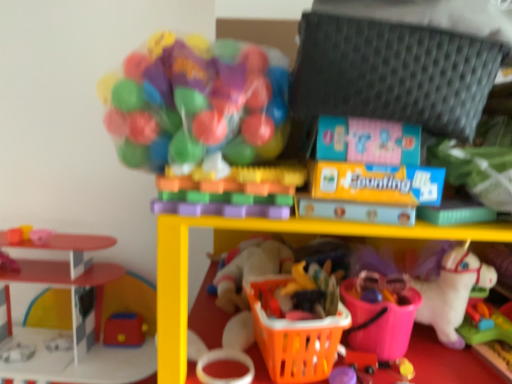
Question: From a real-world perspective, is rubber yellow ball at lower center, arranged as the 2th toy when viewed from the right, below pink rubber ball at left, the second toy in the left-to-right sequence?

Choices:
 (A) no
 (B) yes

Answer: (B)

Question: Is rubber yellow ball at lower center, which ranks as the seventh toy in left-to-right order, oriented away from pink rubber ball at left, the second toy in the left-to-right sequence?

Choices:
 (A) yes
 (B) no

Answer: (B)

Question: From the image's perspective, is rubber yellow ball at lower center, which ranks as the seventh toy in left-to-right order, above pink rubber ball at left, the second toy in the left-to-right sequence?

Choices:
 (A) no
 (B) yes

Answer: (A)

Question: Can you see rubber yellow ball at lower center, arranged as the 2th toy when viewed from the right, touching pink rubber ball at left, the 7th toy from the right?

Choices:
 (A) yes
 (B) no

Answer: (B)

Question: Is rubber yellow ball at lower center, arranged as the 2th toy when viewed from the right, bigger than pink rubber ball at left, the 7th toy from the right?

Choices:
 (A) no
 (B) yes

Answer: (A)

Question: Can you confirm if rubber yellow ball at lower center, which ranks as the seventh toy in left-to-right order, is thinner than pink rubber ball at left, the second toy in the left-to-right sequence?

Choices:
 (A) no
 (B) yes

Answer: (B)

Question: Is the depth of rubberized red toy at lower left, acting as the 5th toy starting from the right, less than that of rubber yellow ball at lower center, arranged as the 2th toy when viewed from the right?

Choices:
 (A) no
 (B) yes

Answer: (A)

Question: Is rubberized red toy at lower left, acting as the 5th toy starting from the right, aimed at rubber yellow ball at lower center, which ranks as the seventh toy in left-to-right order?

Choices:
 (A) yes
 (B) no

Answer: (B)

Question: Is rubber yellow ball at lower center, arranged as the 2th toy when viewed from the right, located within rubberized red toy at lower left, the fourth toy viewed from the left?

Choices:
 (A) no
 (B) yes

Answer: (A)

Question: Is rubberized red toy at lower left, the fourth toy viewed from the left, not within rubber yellow ball at lower center, which ranks as the seventh toy in left-to-right order?

Choices:
 (A) yes
 (B) no

Answer: (A)

Question: Can you confirm if rubberized red toy at lower left, acting as the 5th toy starting from the right, is positioned to the left of rubber yellow ball at lower center, arranged as the 2th toy when viewed from the right?

Choices:
 (A) no
 (B) yes

Answer: (B)

Question: Can you confirm if rubberized red toy at lower left, the fourth toy viewed from the left, is smaller than rubber yellow ball at lower center, which ranks as the seventh toy in left-to-right order?

Choices:
 (A) yes
 (B) no

Answer: (B)

Question: Is smooth plastic toy at left, which is the 8th toy from right to left, completely or partially outside of pink rubber ball at left, the 7th toy from the right?

Choices:
 (A) yes
 (B) no

Answer: (A)